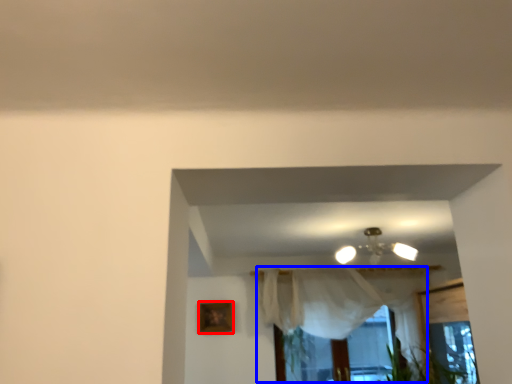
Question: Which object is closer to the camera taking this photo, picture frame (highlighted by a red box) or curtain (highlighted by a blue box)?

Choices:
 (A) picture frame
 (B) curtain

Answer: (B)